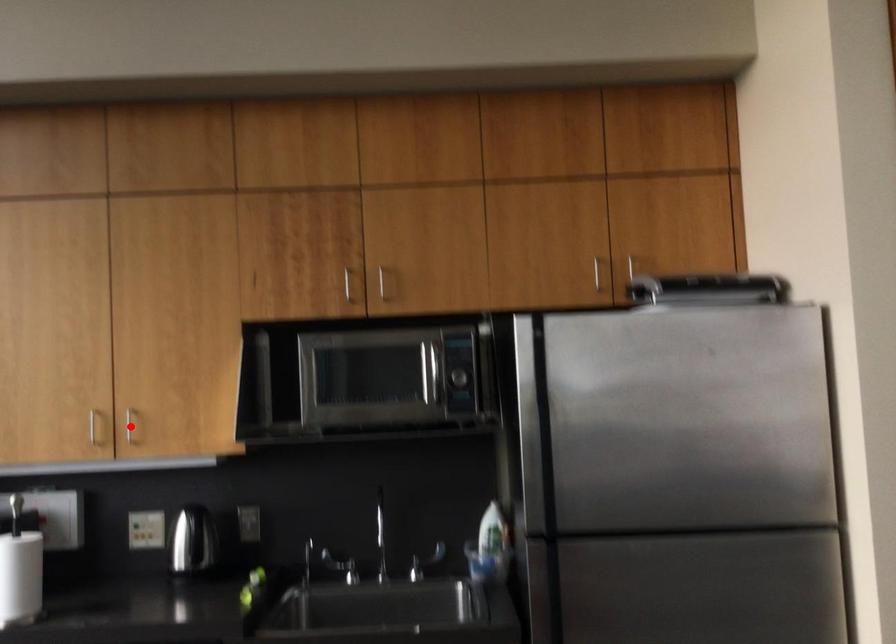
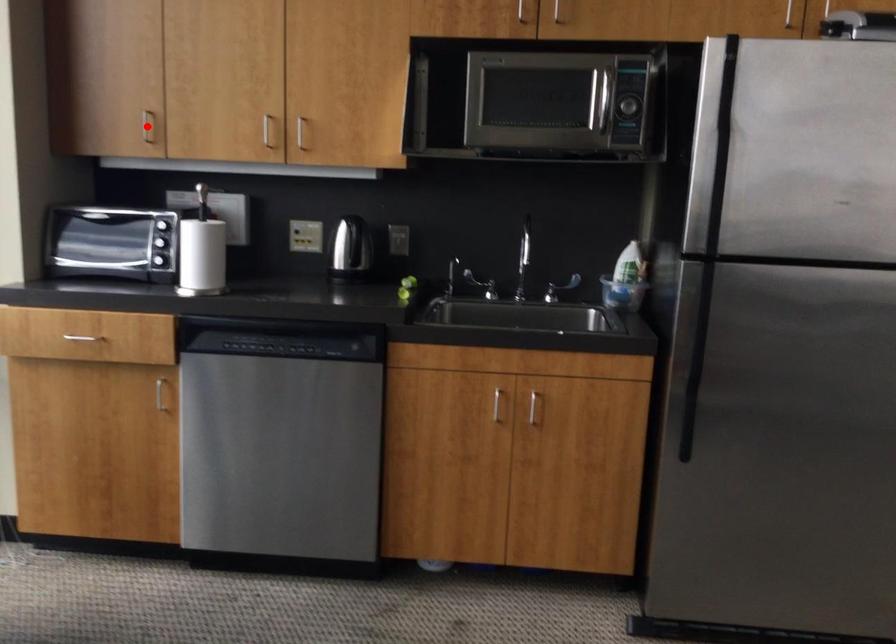
I am providing you with two images of the same scene from different viewpoints. A red point is marked on the first image and another point is marked on the second image. Does the point marked in image1 correspond to the same location as the one in image2?

No